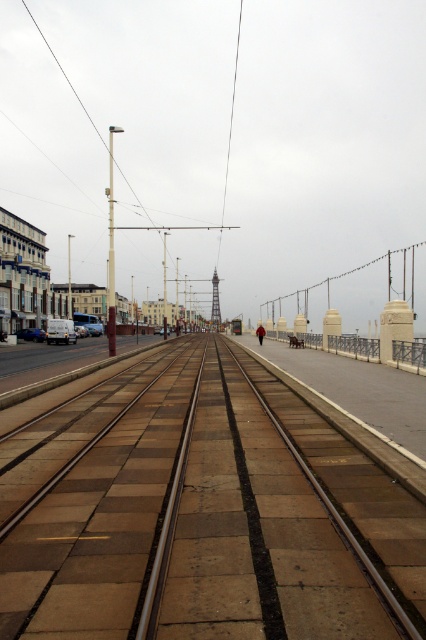
Question: Can you confirm if brown concrete train track at center is thinner than metallic gray tower at center?

Choices:
 (A) no
 (B) yes

Answer: (A)

Question: Which object appears closest to the camera in this image?

Choices:
 (A) metallic gray tower at center
 (B) brown concrete train track at center

Answer: (B)

Question: Which point is closer to the camera?

Choices:
 (A) brown concrete train track at center
 (B) metallic gray tower at center

Answer: (A)

Question: Is brown concrete train track at center positioned behind metallic gray tower at center?

Choices:
 (A) yes
 (B) no

Answer: (B)

Question: Is brown concrete train track at center below metallic gray tower at center?

Choices:
 (A) yes
 (B) no

Answer: (A)

Question: Which point appears farthest from the camera in this image?

Choices:
 (A) (215, 280)
 (B) (54, 548)

Answer: (A)